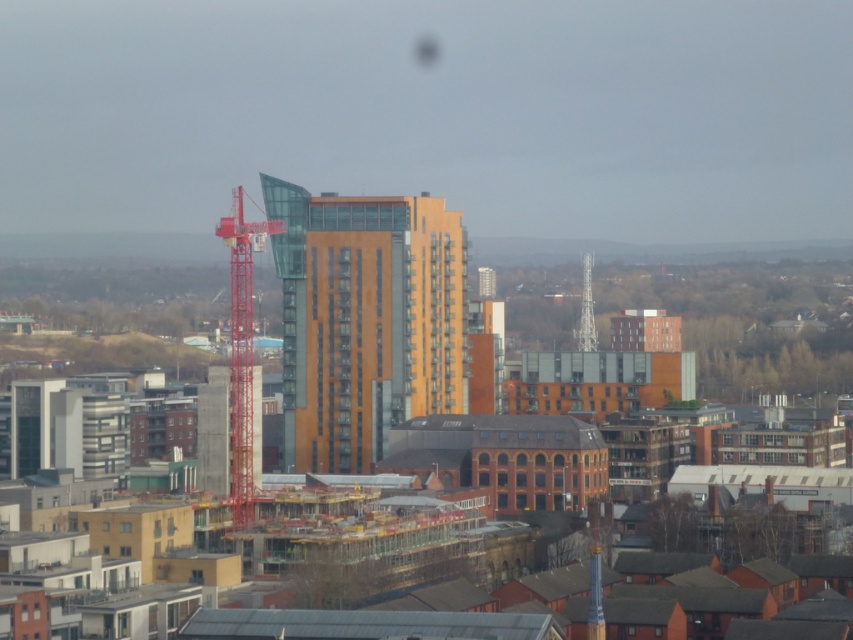
You are a city planner analyzing the urban layout. You need to determine the relative positions of the orange glass building at center and the metallic silver tower at center. Based on the scene, which building is positioned to the left?

The orange glass building at center is to the left of the metallic silver tower at center.

You are a city planner assessing the urban layout. Given the presence of the red metal crane at left and the metallic silver tower at center, which object occupies a larger horizontal space in the scene?

The red metal crane at left might be wider than metallic silver tower at center according to the description provided.

You are a city planner reviewing this urban layout. Based on the image, can you determine if the orange glass building at center is positioned higher up than the red metal crane at left?

The orange glass building at center is located above the red metal crane at left, so yes, it is positioned higher up.